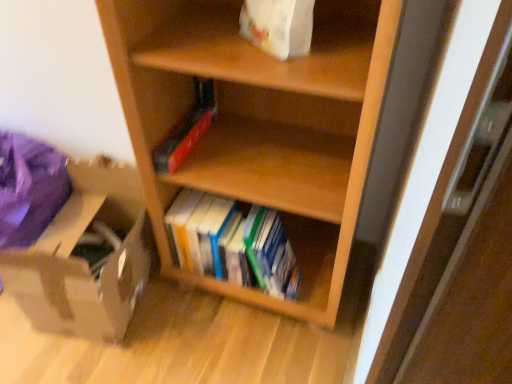
Question: Does brown cardboard box at lower left appear on the right side of hardcover books at center?

Choices:
 (A) no
 (B) yes

Answer: (A)

Question: Considering the relative positions of brown cardboard box at lower left and hardcover books at center in the image provided, is brown cardboard box at lower left in front of hardcover books at center?

Choices:
 (A) no
 (B) yes

Answer: (B)

Question: Can you confirm if brown cardboard box at lower left is bigger than hardcover books at center?

Choices:
 (A) no
 (B) yes

Answer: (B)

Question: Is brown cardboard box at lower left wider than hardcover books at center?

Choices:
 (A) no
 (B) yes

Answer: (B)

Question: From a real-world perspective, is brown cardboard box at lower left below hardcover books at center?

Choices:
 (A) no
 (B) yes

Answer: (B)

Question: Is white paper bag at upper center wider or thinner than hardcover books at center?

Choices:
 (A) wide
 (B) thin

Answer: (B)

Question: From a real-world perspective, is white paper bag at upper center positioned above or below hardcover books at center?

Choices:
 (A) above
 (B) below

Answer: (A)

Question: From the image's perspective, is white paper bag at upper center located above or below hardcover books at center?

Choices:
 (A) below
 (B) above

Answer: (B)

Question: Relative to hardcover books at center, is white paper bag at upper center in front or behind?

Choices:
 (A) front
 (B) behind

Answer: (A)

Question: Would you say wooden shelf at center is to the left or to the right of brown cardboard box at lower left in the picture?

Choices:
 (A) right
 (B) left

Answer: (A)

Question: From a real-world perspective, is wooden shelf at center physically located above or below brown cardboard box at lower left?

Choices:
 (A) below
 (B) above

Answer: (B)

Question: Is wooden shelf at center bigger or smaller than brown cardboard box at lower left?

Choices:
 (A) small
 (B) big

Answer: (B)

Question: Is point (333, 21) positioned closer to the camera than point (96, 183)?

Choices:
 (A) closer
 (B) farther

Answer: (A)

Question: In terms of height, does brown cardboard box at lower left look taller or shorter compared to wooden shelf at center?

Choices:
 (A) tall
 (B) short

Answer: (B)

Question: From a real-world perspective, is brown cardboard box at lower left above or below wooden shelf at center?

Choices:
 (A) below
 (B) above

Answer: (A)